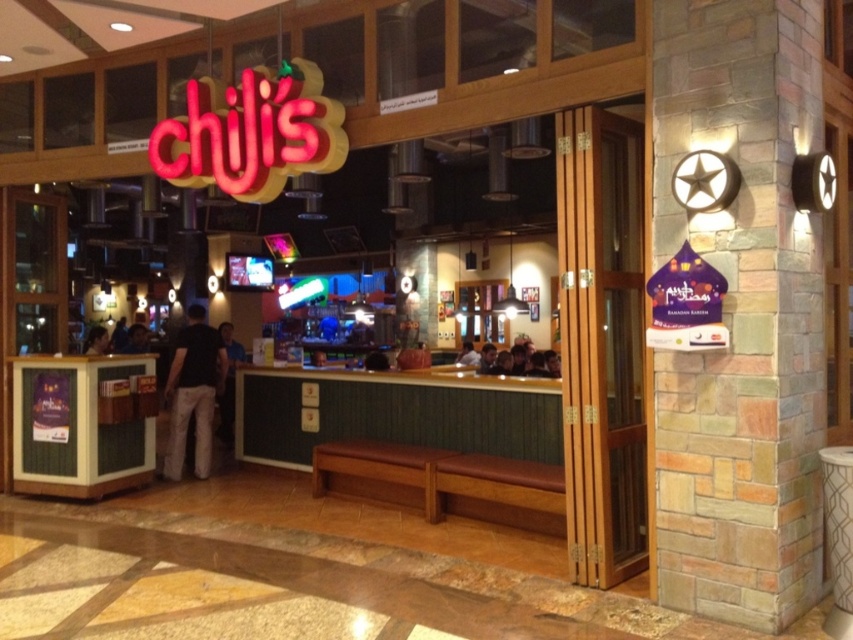
You are a customer entering Chili s restaurant and you see the black cotton pants at center and the black shirt at left. Which item is closer to you as you approach the entrance?

The black cotton pants at center is closer to you because it is in front of the black shirt at left.

You are standing at the entrance of Chili s restaurant and see two points marked on the floor. The first point is at coordinate point (635, 339) and the second is at point (105, 349). If you want to walk towards the point that is closer to the entrance, which coordinate should you head towards?

Point (105, 349) is closer to the entrance because it is behind point (635, 339), which is in front of it. Since you are at the entrance, the point further back would be nearer to your current position.